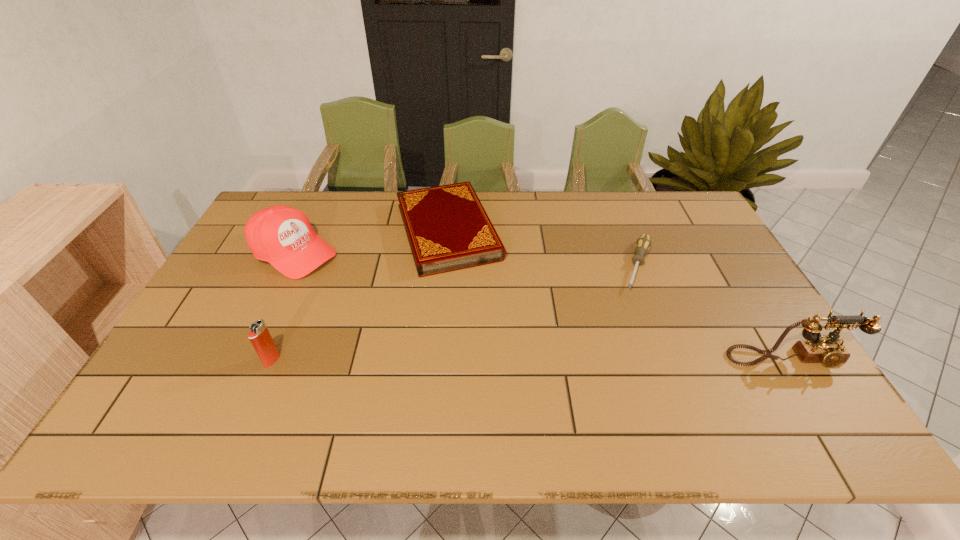
You are a GUI agent. You are given a task and a screenshot of the screen. Output one action in this format:
    pyautogui.click(x=<x>, y=<y>)
    Task: Click on the object at the left edge
    
    Given the screenshot: What is the action you would take?
    (281, 235)

Locate an element on the screen. object that is at the right edge is located at coordinates (829, 350).

Image resolution: width=960 pixels, height=540 pixels. In order to click on object that is at the far left corner in this screenshot , I will do `click(281, 235)`.

Identify the location of object located at the near right corner. [829, 350].

Identify the location of vacant space at the far edge. (591, 218).

Identify the location of free location at the near edge of the desktop. This screenshot has width=960, height=540. (405, 372).

Identify the location of free space at the left edge of the desktop. The width and height of the screenshot is (960, 540). (229, 295).

This screenshot has height=540, width=960. What are the coordinates of `free region at the right edge of the desktop` in the screenshot? It's located at tap(713, 284).

This screenshot has height=540, width=960. In order to click on vacant space at the far left corner in this screenshot , I will do `click(271, 201)`.

The width and height of the screenshot is (960, 540). I want to click on vacant space at the near left corner, so click(x=165, y=366).